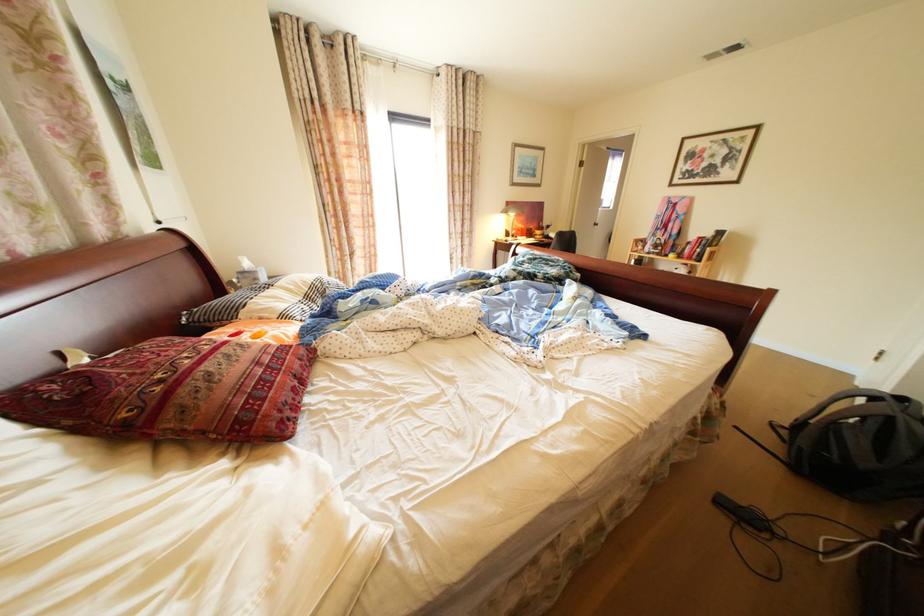
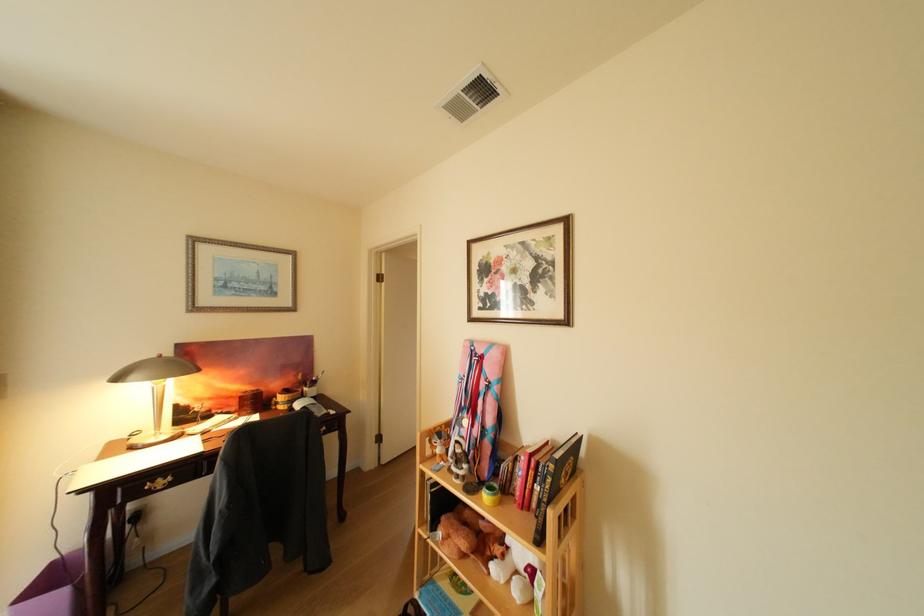
Find the pixel in the second image that matches [685,257] in the first image.

(499, 499)